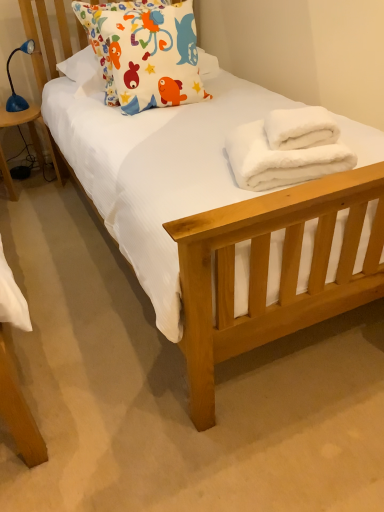
Question: Considering the relative sizes of matte fabric pillow at upper left and blue plastic lamp at left in the image provided, is matte fabric pillow at upper left bigger than blue plastic lamp at left?

Choices:
 (A) yes
 (B) no

Answer: (A)

Question: Is matte fabric pillow at upper left shorter than blue plastic lamp at left?

Choices:
 (A) yes
 (B) no

Answer: (B)

Question: Can you confirm if matte fabric pillow at upper left is thinner than blue plastic lamp at left?

Choices:
 (A) no
 (B) yes

Answer: (A)

Question: Is matte fabric pillow at upper left turned away from blue plastic lamp at left?

Choices:
 (A) no
 (B) yes

Answer: (A)

Question: Does matte fabric pillow at upper left have a greater width compared to blue plastic lamp at left?

Choices:
 (A) no
 (B) yes

Answer: (B)

Question: From their relative heights in the image, would you say blue plastic lamp at left is taller or shorter than blue plastic lamp at left?

Choices:
 (A) tall
 (B) short

Answer: (A)

Question: In terms of width, does blue plastic lamp at left look wider or thinner when compared to blue plastic lamp at left?

Choices:
 (A) thin
 (B) wide

Answer: (B)

Question: Does point (1, 115) appear closer or farther from the camera than point (11, 102)?

Choices:
 (A) closer
 (B) farther

Answer: (A)

Question: Based on their sizes in the image, would you say blue plastic lamp at left is bigger or smaller than blue plastic lamp at left?

Choices:
 (A) small
 (B) big

Answer: (B)

Question: Based on their sizes in the image, would you say blue plastic lamp at left is bigger or smaller than white fluffy bath towel at center, the 1th bath towel in the top-to-bottom sequence?

Choices:
 (A) big
 (B) small

Answer: (A)

Question: Is blue plastic lamp at left in front of or behind white fluffy bath towel at center, the second bath towel positioned from the bottom, in the image?

Choices:
 (A) front
 (B) behind

Answer: (B)

Question: In terms of height, does blue plastic lamp at left look taller or shorter compared to white fluffy bath towel at center, the second bath towel positioned from the bottom?

Choices:
 (A) short
 (B) tall

Answer: (B)

Question: Do you think blue plastic lamp at left is within white fluffy bath towel at center, the 1th bath towel in the top-to-bottom sequence, or outside of it?

Choices:
 (A) outside
 (B) inside

Answer: (A)

Question: From their relative heights in the image, would you say white fluffy bath towel at center, the second bath towel positioned from the bottom, is taller or shorter than matte fabric pillow at upper left?

Choices:
 (A) short
 (B) tall

Answer: (A)

Question: From the image's perspective, is white fluffy bath towel at center, the second bath towel positioned from the bottom, above or below matte fabric pillow at upper left?

Choices:
 (A) above
 (B) below

Answer: (B)